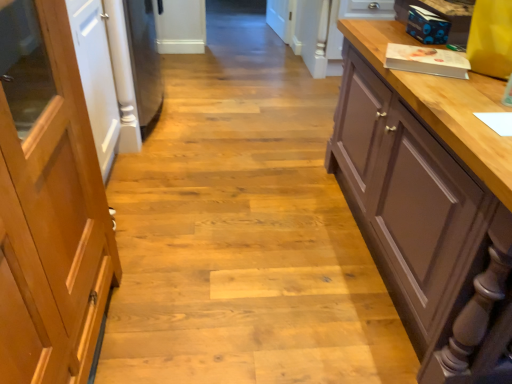
Question: Is light brown wood door at left inside the boundaries of brown matte cupboard at right, or outside?

Choices:
 (A) inside
 (B) outside

Answer: (B)

Question: Is point (53, 281) closer or farther from the camera than point (384, 256)?

Choices:
 (A) closer
 (B) farther

Answer: (A)

Question: In the image, is light brown wood door at left on the left side or the right side of brown matte cupboard at right?

Choices:
 (A) right
 (B) left

Answer: (B)

Question: From their relative heights in the image, would you say brown matte cupboard at right is taller or shorter than light brown wood door at left?

Choices:
 (A) tall
 (B) short

Answer: (B)

Question: Does point (376, 130) appear closer or farther from the camera than point (83, 304)?

Choices:
 (A) closer
 (B) farther

Answer: (B)

Question: Relative to light brown wood door at left, is brown matte cupboard at right in front or behind?

Choices:
 (A) front
 (B) behind

Answer: (B)

Question: In terms of size, does brown matte cupboard at right appear bigger or smaller than light brown wood door at left?

Choices:
 (A) big
 (B) small

Answer: (A)